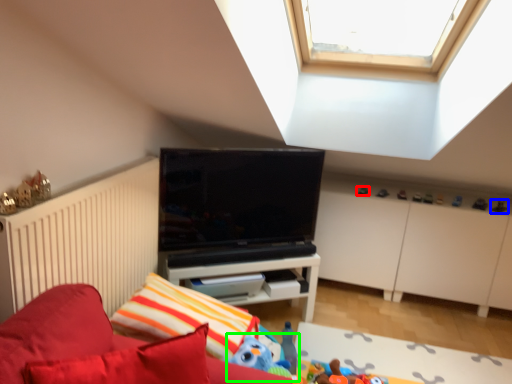
Question: Which object is positioned closest to toy (highlighted by a red box)? Select from toy (highlighted by a blue box) and toy (highlighted by a green box).

Choices:
 (A) toy
 (B) toy

Answer: (A)